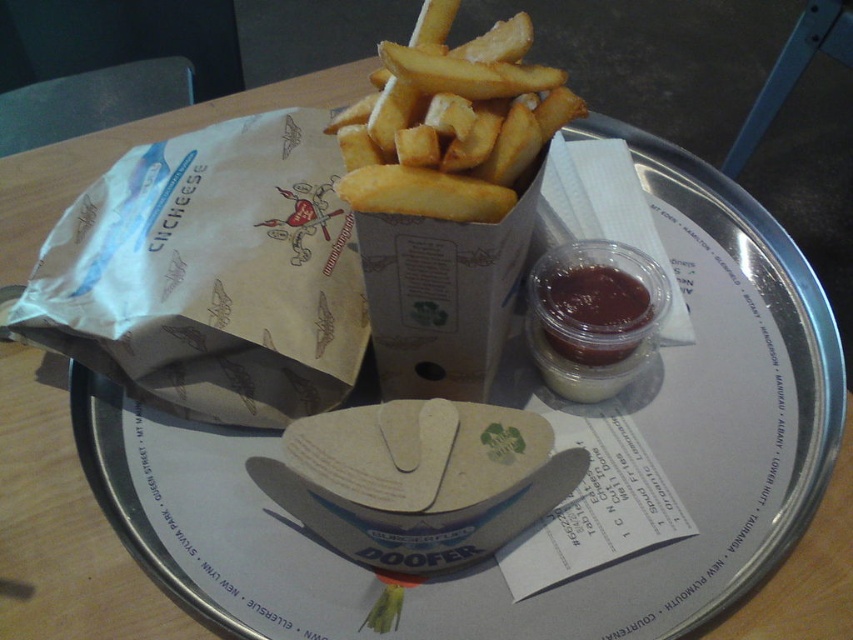
Question: Which point is farther to the camera?

Choices:
 (A) golden crispy french fries at center
 (B) shiny plastic cup of tomato sauce at center-right

Answer: (B)

Question: Is golden crispy french fries at center wider than shiny plastic cup of tomato sauce at center-right?

Choices:
 (A) no
 (B) yes

Answer: (B)

Question: Which of the following is the farthest from the observer?

Choices:
 (A) (554, 321)
 (B) (457, 168)

Answer: (A)

Question: Which point is farther from the camera taking this photo?

Choices:
 (A) (425, 168)
 (B) (583, 337)

Answer: (B)

Question: Does golden crispy french fries at center have a smaller size compared to shiny plastic cup of tomato sauce at center-right?

Choices:
 (A) yes
 (B) no

Answer: (B)

Question: Can you confirm if golden crispy french fries at center is positioned to the left of shiny plastic cup of tomato sauce at center-right?

Choices:
 (A) no
 (B) yes

Answer: (B)